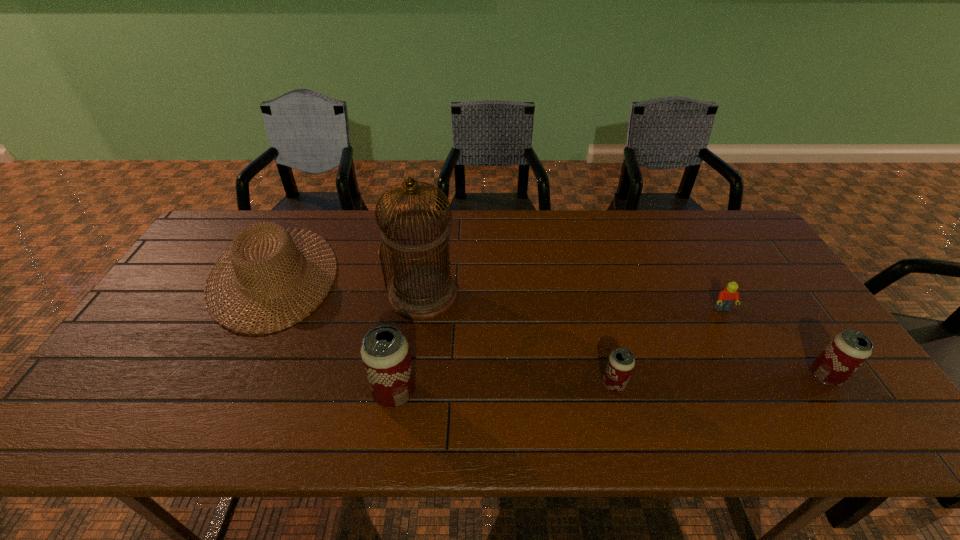
Locate an element on the screen. The width and height of the screenshot is (960, 540). the leftmost beer can is located at coordinates pyautogui.click(x=385, y=353).

Where is `the fifth shortest object`? The width and height of the screenshot is (960, 540). the fifth shortest object is located at coordinates (385, 353).

This screenshot has height=540, width=960. What are the coordinates of `the second beer can from right to left` in the screenshot? It's located at (621, 362).

Identify the location of the third object from right to left. (621, 362).

At what (x,y) coordinates should I click in order to perform the action: click on the second tallest beer can. Please return your answer as a coordinate pair (x, y). Looking at the image, I should click on (847, 351).

Where is `the rightmost object`? This screenshot has height=540, width=960. the rightmost object is located at coordinates (847, 351).

Identify the location of sunhat. This screenshot has height=540, width=960. pos(284,239).

Identify the location of the fifth object from left to right. (726, 297).

Locate an element on the screen. The width and height of the screenshot is (960, 540). the tallest object is located at coordinates (420, 293).

Where is `vacant space located on the right of the leftmost beer can`? The width and height of the screenshot is (960, 540). vacant space located on the right of the leftmost beer can is located at coordinates (530, 393).